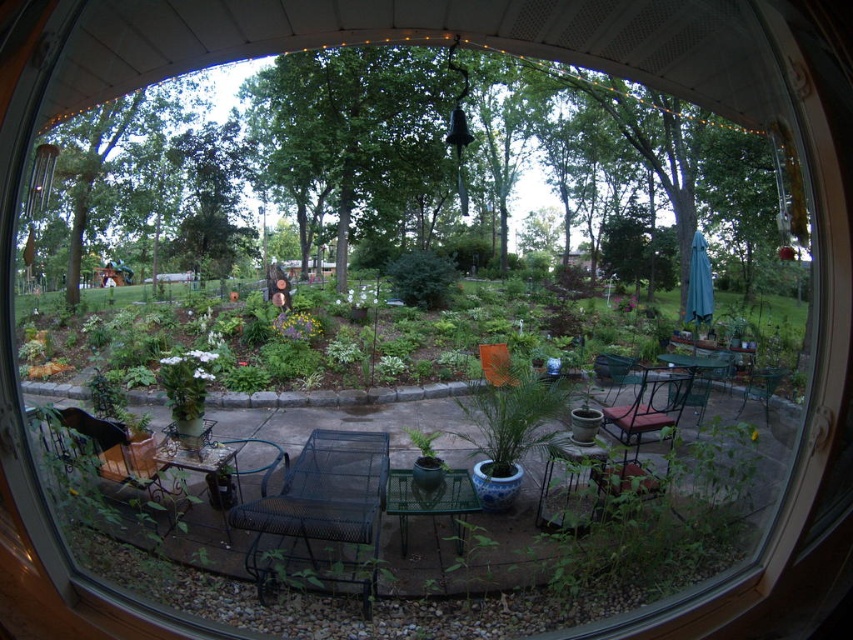
Question: Which point is farther to the camera?

Choices:
 (A) metallic brown chair at center-right
 (B) metallic green chair at center-right
 (C) metal mesh chair at center

Answer: (B)

Question: Which of the following is the farthest from the observer?

Choices:
 (A) (358, 456)
 (B) (550, 387)

Answer: (A)

Question: From the image, what is the correct spatial relationship of metal mesh chair at center in relation to metallic brown chair at center-right?

Choices:
 (A) right
 (B) left

Answer: (B)

Question: Considering the relative positions of green leafy plants at center and orange fabric chair at center in the image provided, where is green leafy plants at center located with respect to orange fabric chair at center?

Choices:
 (A) right
 (B) left

Answer: (A)

Question: Is blue glazed pot at center closer to the viewer compared to metallic black chair at lower left?

Choices:
 (A) yes
 (B) no

Answer: (B)

Question: Which object is positioned farthest from the blue glazed pot at center?

Choices:
 (A) green leafy plants at center
 (B) orange fabric chair at center
 (C) green metal chair at lower right

Answer: (A)